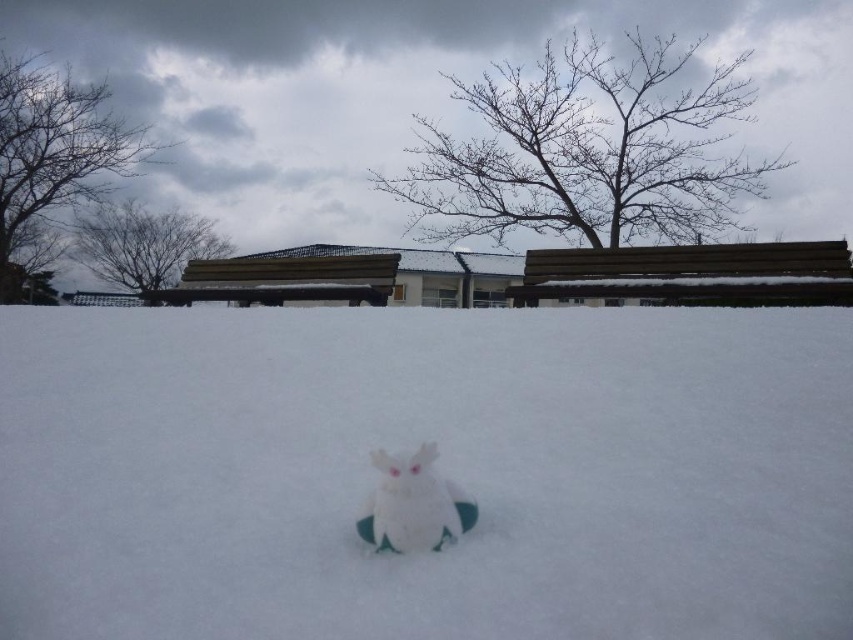
Question: Does white fluffy snow at center appear on the right side of white fabric snowman at center?

Choices:
 (A) no
 (B) yes

Answer: (A)

Question: Which of these objects is positioned farthest from the wooden bench at upper right?

Choices:
 (A) white fabric snowman at center
 (B) white fluffy snow at center

Answer: (A)

Question: Which of the following is the closest to the observer?

Choices:
 (A) (442, 518)
 (B) (613, 273)
 (C) (828, 368)

Answer: (A)

Question: Can you confirm if wooden bench at upper right is positioned to the left of white fabric snowman at center?

Choices:
 (A) no
 (B) yes

Answer: (A)

Question: Which point is closer to the camera?

Choices:
 (A) white fabric snowman at center
 (B) white fluffy snow at center

Answer: (B)

Question: Observing the image, what is the correct spatial positioning of white fluffy snow at center in reference to wooden bench at upper right?

Choices:
 (A) above
 (B) below

Answer: (B)